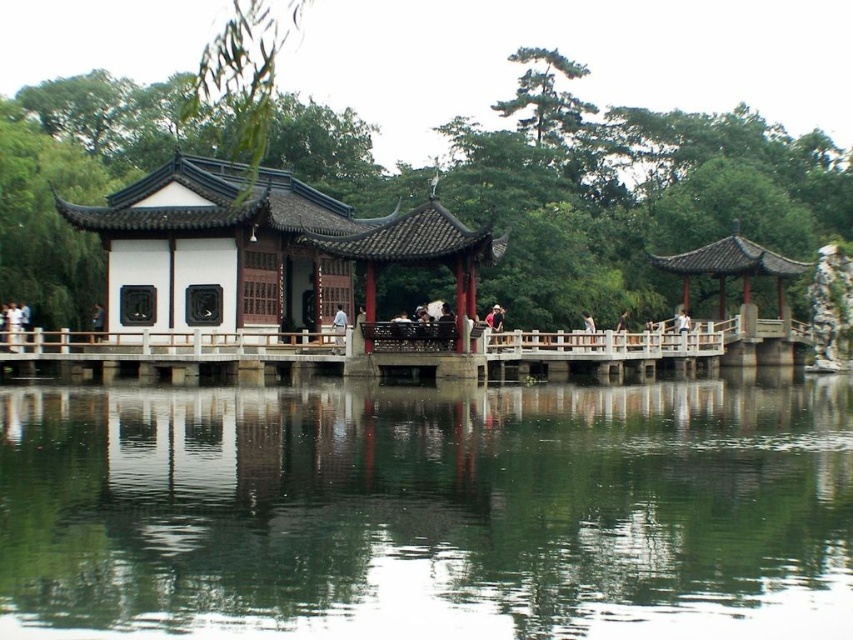
Who is lower down, green reflective water at center or white wooden pavilion at center?

green reflective water at center

Is point (622, 564) positioned behind point (114, 250)?

That is False.

Find the location of a particular element. The height and width of the screenshot is (640, 853). green reflective water at center is located at coordinates (427, 512).

Between matte black person at center and light brown wooden bench at center, which one is positioned higher?

light brown wooden bench at center

Can you confirm if matte black person at center is taller than light brown wooden bench at center?

No, matte black person at center is not taller than light brown wooden bench at center.

Which is behind, point (97, 310) or point (584, 340)?

Point (97, 310)

Where is `matte black person at center`? matte black person at center is located at coordinates (97, 323).

Locate an element on the screen. This screenshot has width=853, height=640. white wooden pavilion at center is located at coordinates (257, 248).

Between white wooden pavilion at center and matte black person at center, which one is positioned higher?

white wooden pavilion at center is higher up.

Is point (77, 221) farther from camera compared to point (94, 317)?

No, it is not.

At what (x,y) coordinates should I click in order to perform the action: click on white wooden pavilion at center. Please return your answer as a coordinate pair (x, y). This screenshot has width=853, height=640. Looking at the image, I should click on (257, 248).